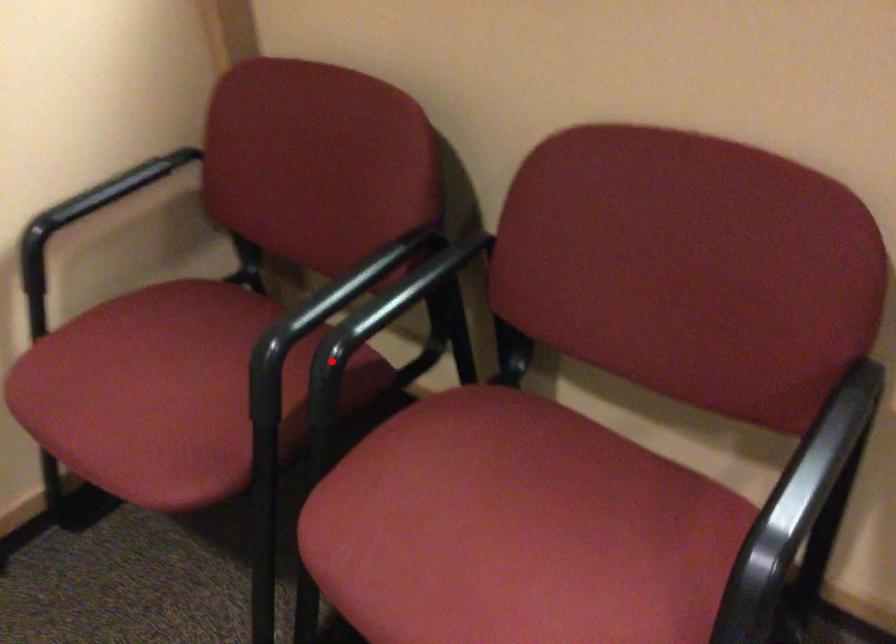
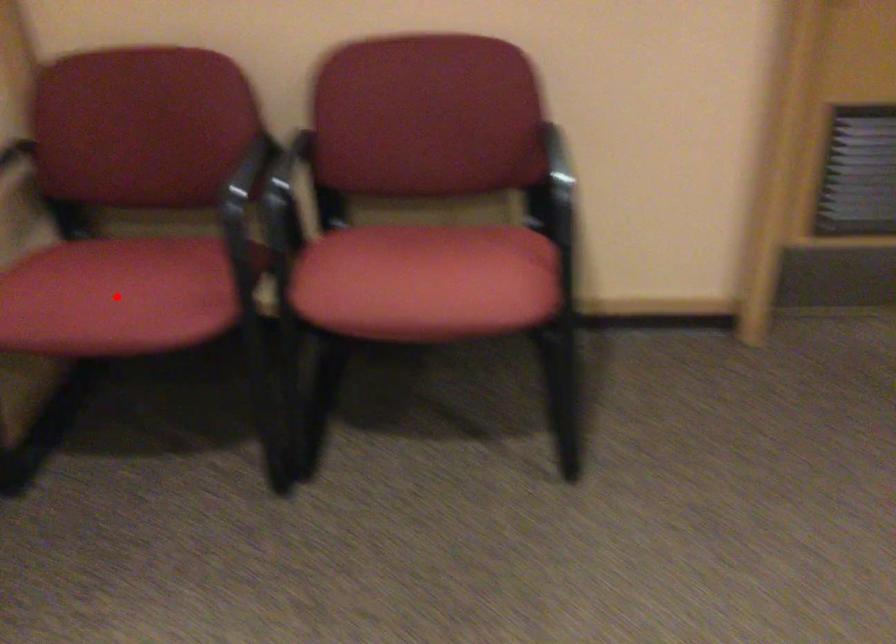
Based on the photo, I am providing you with two images of the same scene from different viewpoints. A red point is marked on the first image and another point is marked on the second image. Is the marked point in image1 the same physical position as the marked point in image2?

No